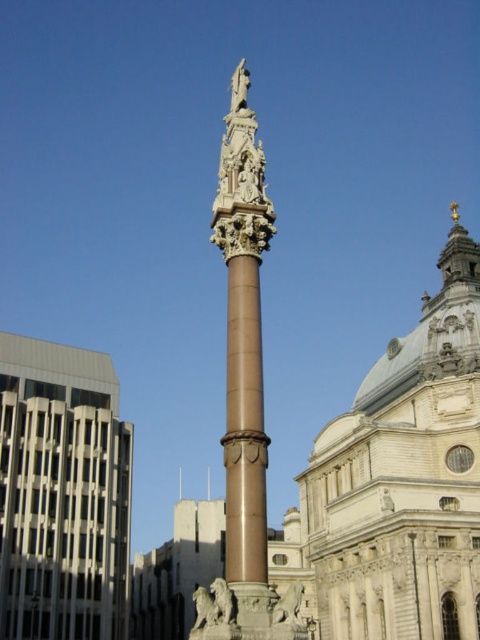
You are standing in the square and want to take a photo of the light beige stone tower at center and the white glass building at left. Which one should you focus on first if you want both to be in sharp focus?

You should focus on the light beige stone tower at center first because it is closer to you than the white glass building at left, so adjusting focus from near to far will help both be in sharp focus.

You are standing at the entrance of the city park and want to locate the light beige stone tower at center. According to the map, your current position is at point A. Which direction should you move to reach the tower?

The light beige stone tower at center is located at point (x=404, y=477), so you should move towards the northeast direction from your current position at point A to reach the tower.